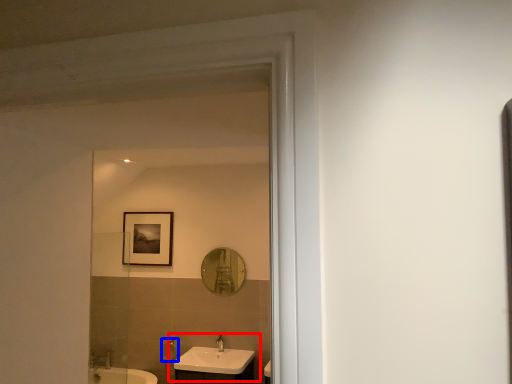
Question: Which object appears farthest to the camera in this image, sink (highlighted by a red box) or shower (highlighted by a blue box)?

Choices:
 (A) sink
 (B) shower

Answer: (B)